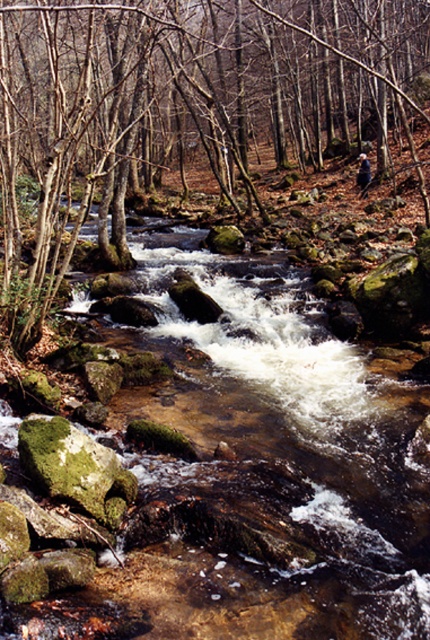
Question: Is clear water at center positioned at the back of green mossy rock at center?

Choices:
 (A) yes
 (B) no

Answer: (B)

Question: Does clear water at center appear on the left side of green mossy rock at lower left?

Choices:
 (A) no
 (B) yes

Answer: (A)

Question: Which of these objects is positioned farthest from the green mossy rock at lower left?

Choices:
 (A) clear water at center
 (B) green mossy rock at center

Answer: (B)

Question: Which point is farther to the camera?

Choices:
 (A) (387, 556)
 (B) (86, 448)
 (C) (132, 160)

Answer: (C)

Question: Among these points, which one is nearest to the camera?

Choices:
 (A) (371, 97)
 (B) (344, 470)
 (C) (49, 435)

Answer: (C)

Question: Can you confirm if green mossy rock at center is thinner than green mossy rock at lower left?

Choices:
 (A) no
 (B) yes

Answer: (A)